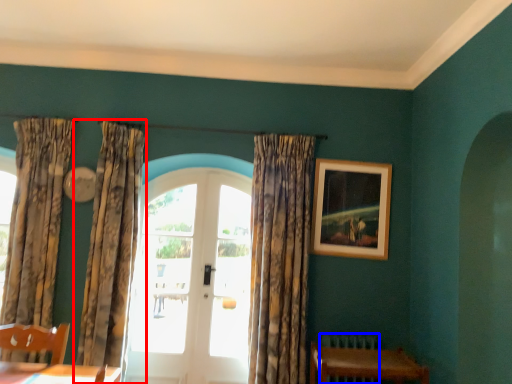
Question: Which of the following is the farthest to the observer, curtain (highlighted by a red box) or radiator (highlighted by a blue box)?

Choices:
 (A) curtain
 (B) radiator

Answer: (B)